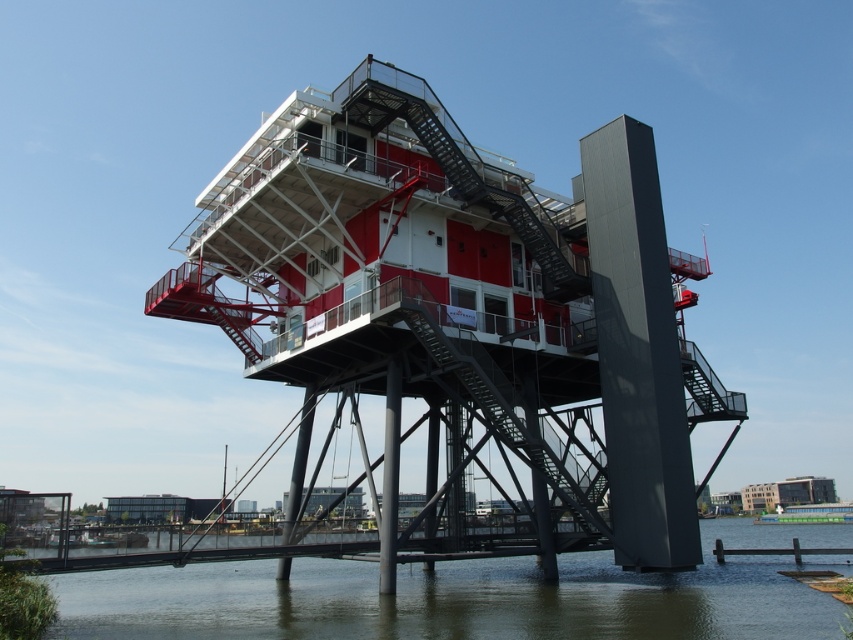
Question: Is metallic red observation tower at center below green murky water at lower center?

Choices:
 (A) no
 (B) yes

Answer: (A)

Question: Which of the following is the closest to the observer?

Choices:
 (A) (784, 602)
 (B) (258, 269)

Answer: (A)

Question: Among these points, which one is nearest to the camera?

Choices:
 (A) (196, 296)
 (B) (177, 588)

Answer: (A)

Question: Where is metallic red observation tower at center located in relation to green murky water at lower center in the image?

Choices:
 (A) right
 (B) left

Answer: (B)

Question: Which point is closer to the camera?

Choices:
 (A) (434, 570)
 (B) (379, 148)

Answer: (B)

Question: Can you confirm if metallic red observation tower at center is positioned to the left of green murky water at lower center?

Choices:
 (A) no
 (B) yes

Answer: (B)